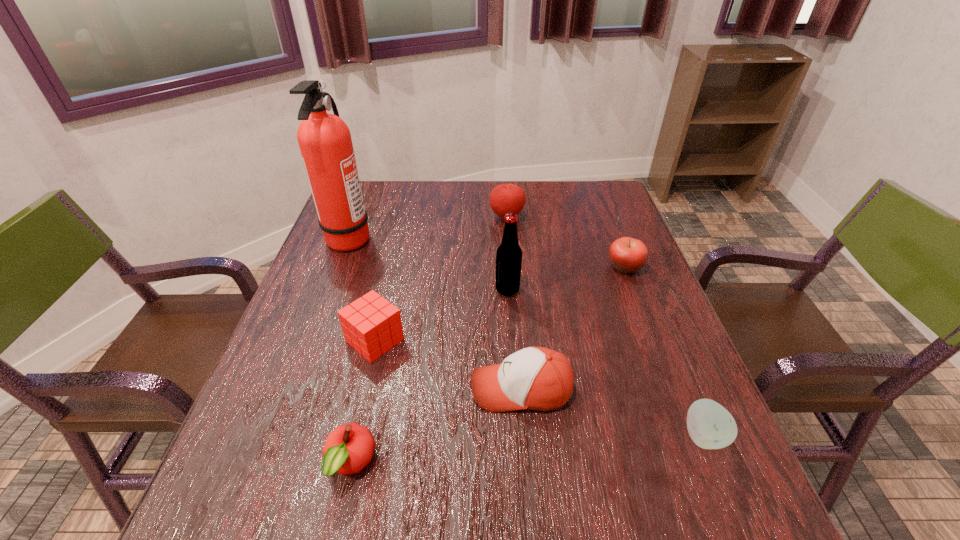
At what (x,y) coordinates should I click in order to perform the action: click on vacant space at the far right corner of the desktop. Please return your answer as a coordinate pair (x, y). Looking at the image, I should click on (602, 214).

Where is `empty space between the leftmost apple and the third nearest object`? The image size is (960, 540). empty space between the leftmost apple and the third nearest object is located at coordinates (436, 426).

Find the location of a particular element. The width and height of the screenshot is (960, 540). free space that is in between the leftmost apple and the beer bottle is located at coordinates (429, 376).

Locate an element on the screen. The height and width of the screenshot is (540, 960). free space that is in between the second farthest apple and the second tallest object is located at coordinates (566, 279).

You are a GUI agent. You are given a task and a screenshot of the screen. Output one action in this format:
    pyautogui.click(x=<x>, y=<y>)
    Task: Click on the empty space between the sixth farthest object and the cube
    This screenshot has height=540, width=960.
    Given the screenshot: What is the action you would take?
    pyautogui.click(x=448, y=364)

You are a GUI agent. You are given a task and a screenshot of the screen. Output one action in this format:
    pyautogui.click(x=<x>, y=<y>)
    Task: Click on the free space that is in between the baseball cap and the fire extinguisher
    Image resolution: width=960 pixels, height=540 pixels.
    Given the screenshot: What is the action you would take?
    pyautogui.click(x=436, y=313)

Where is `free space between the baseball cap and the farthest apple`? This screenshot has height=540, width=960. free space between the baseball cap and the farthest apple is located at coordinates (515, 303).

Locate an element on the screen. The width and height of the screenshot is (960, 540). free spot between the fire extinguisher and the leftmost apple is located at coordinates (350, 350).

The width and height of the screenshot is (960, 540). What are the coordinates of `free space between the leftmost object and the baseball cap` in the screenshot? It's located at (436, 313).

The width and height of the screenshot is (960, 540). I want to click on object that is the closest one to the tallest object, so click(371, 325).